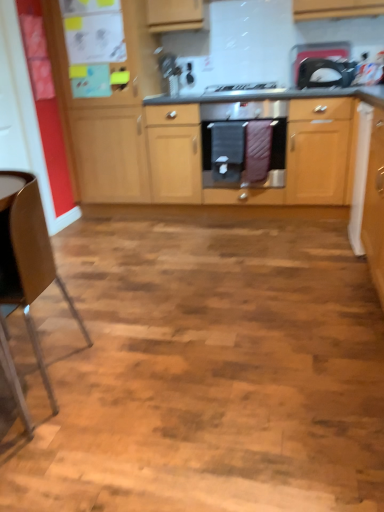
Question: From a real-world perspective, is white glossy microwave at upper right positioned above or below wooden cabinets at center?

Choices:
 (A) above
 (B) below

Answer: (A)

Question: Looking at their shapes, would you say white glossy microwave at upper right is wider or thinner than wooden cabinets at center?

Choices:
 (A) thin
 (B) wide

Answer: (A)

Question: Considering the real-world distances, which object is closest to the wooden cabinets at center?

Choices:
 (A) brown leather chair at left
 (B) black matte gas stove at center
 (C) white glossy microwave at upper right
 (D) black fabric oven mitts at center

Answer: (D)

Question: Which object is positioned closest to the brown leather chair at left?

Choices:
 (A) black fabric oven mitts at center
 (B) black matte gas stove at center
 (C) wooden cabinets at center
 (D) white glossy microwave at upper right

Answer: (A)